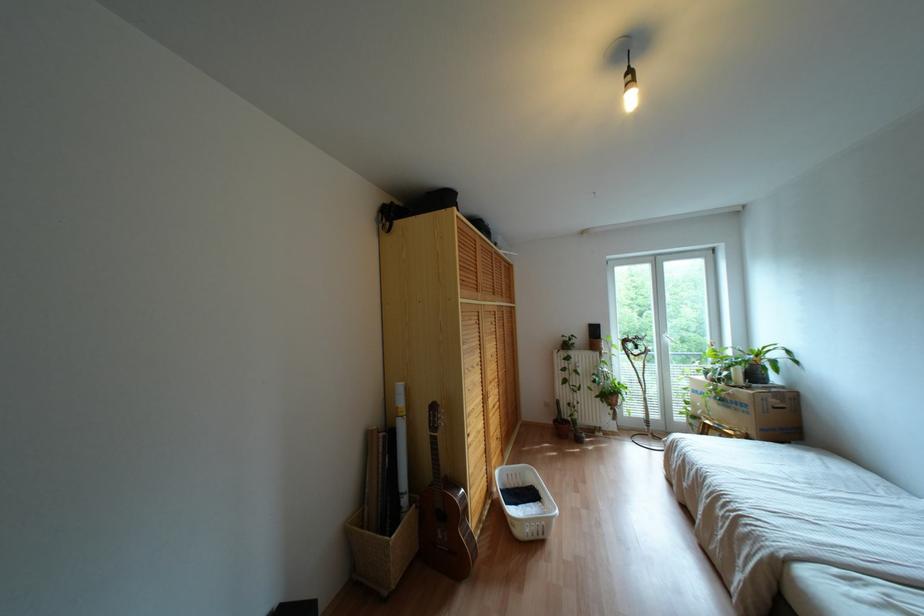
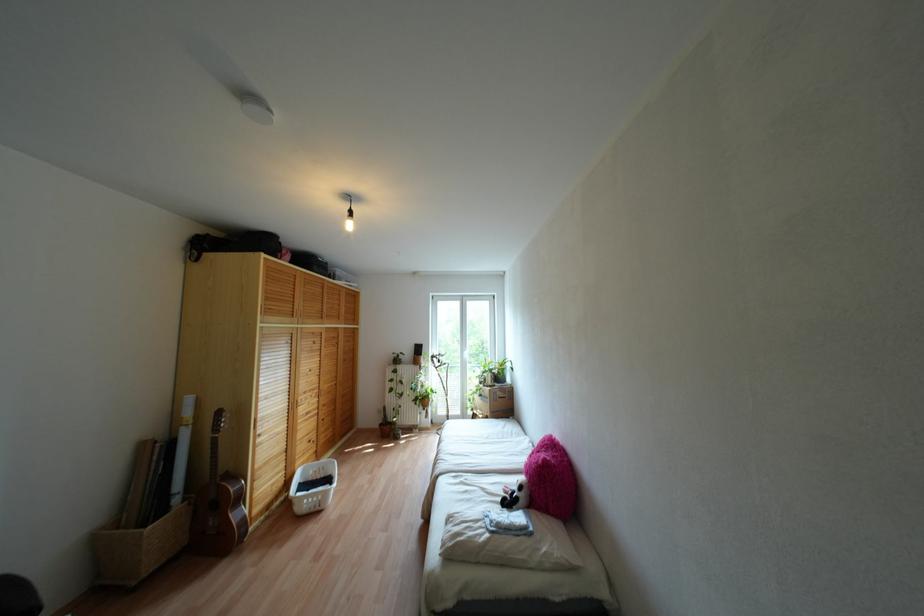
Locate, in the second image, the point that corresponds to (493,406) in the first image.

(307, 413)